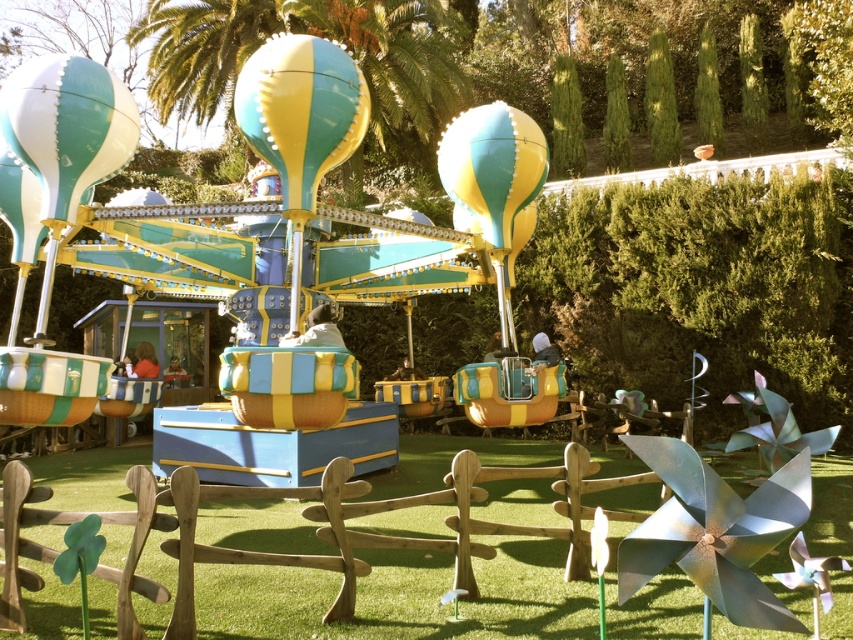
Which is more to the left, matte yellow and blue carousel at center or teal and yellow striped balloon at center?

From the viewer's perspective, matte yellow and blue carousel at center appears more on the left side.

Who is shorter, matte yellow and blue carousel at center or teal and yellow striped balloon at center?

Standing shorter between the two is matte yellow and blue carousel at center.

Does point (207, 225) come farther from viewer compared to point (335, 115)?

Yes, point (207, 225) is farther from viewer.

Image resolution: width=853 pixels, height=640 pixels. Find the location of `matte yellow and blue carousel at center`. matte yellow and blue carousel at center is located at coordinates (312, 260).

Does teal and yellow striped balloon at center have a lesser width compared to teal glossy hot air balloon at upper left?

Yes, teal and yellow striped balloon at center is thinner than teal glossy hot air balloon at upper left.

Is the position of teal and yellow striped balloon at center more distant than that of teal glossy hot air balloon at upper left?

No, teal and yellow striped balloon at center is closer to the viewer.

Is point (331, 45) closer to camera compared to point (4, 132)?

Yes, point (331, 45) is in front of point (4, 132).

What are the coordinates of `teal and yellow striped balloon at center` in the screenshot? It's located at (300, 112).

Is matte yellow and blue carousel at center to the right of matte plastic balloon at center from the viewer's perspective?

In fact, matte yellow and blue carousel at center is to the left of matte plastic balloon at center.

Does point (497, 289) come closer to viewer compared to point (525, 148)?

No, it is behind (525, 148).

Image resolution: width=853 pixels, height=640 pixels. I want to click on matte yellow and blue carousel at center, so click(312, 260).